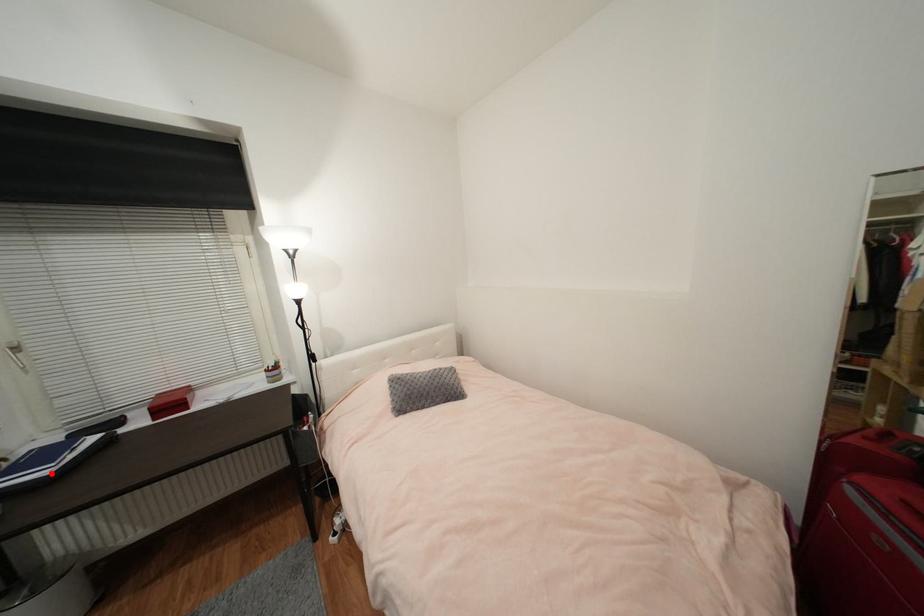
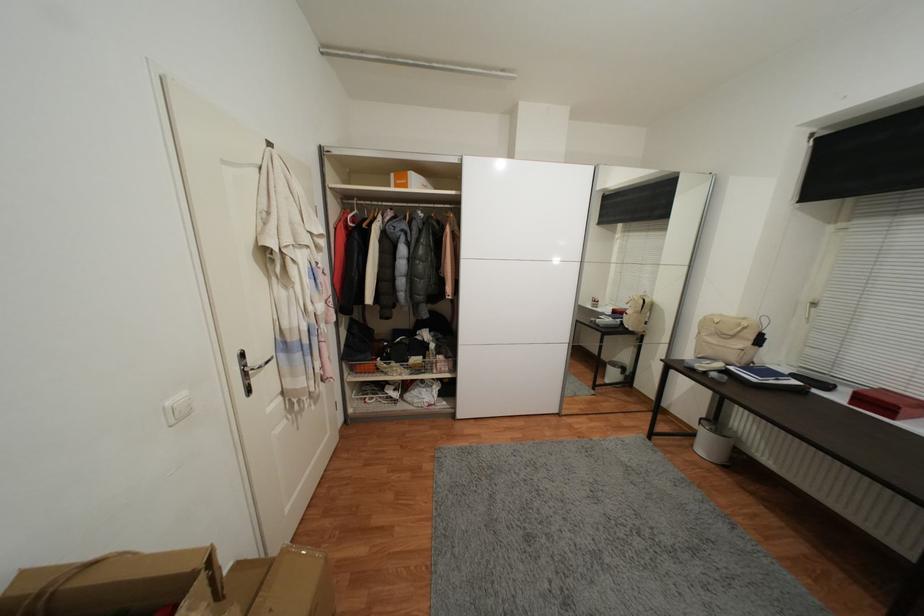
Find the pixel in the second image that matches the highlighted location in the first image.

(759, 381)